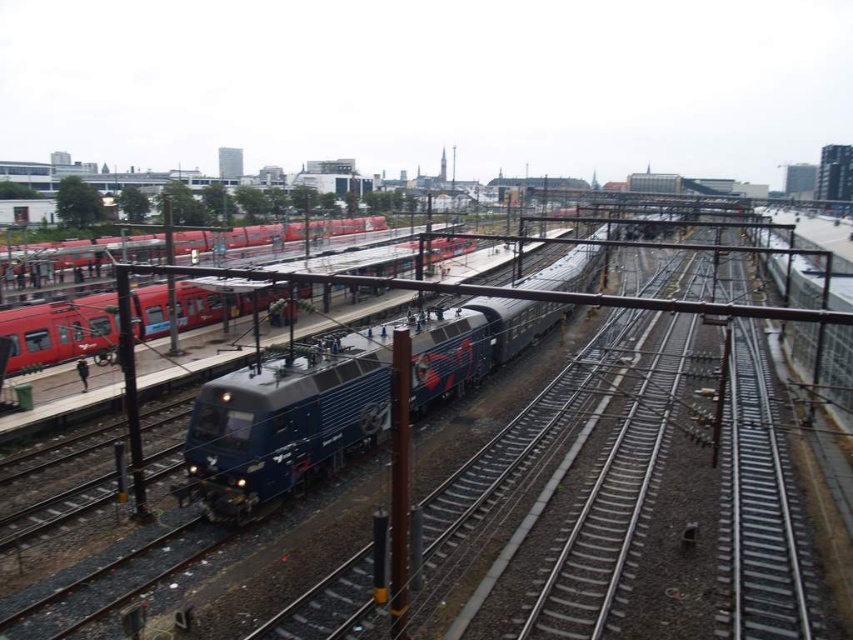
Question: Which point is farther to the camera?

Choices:
 (A) red matte train at left
 (B) metallic blue train at center
 (C) matte red train at left

Answer: (A)

Question: Does metallic blue train at center appear under red matte train at left?

Choices:
 (A) yes
 (B) no

Answer: (A)

Question: Which object appears closest to the camera in this image?

Choices:
 (A) red matte train at left
 (B) metallic blue train at center
 (C) matte red train at left
 (D) metallic blue locomotive at center

Answer: (B)

Question: Does metallic blue locomotive at center have a lesser width compared to matte red train at left?

Choices:
 (A) yes
 (B) no

Answer: (A)

Question: Which is farther from the metallic blue train at center?

Choices:
 (A) metallic blue locomotive at center
 (B) matte red train at left

Answer: (B)

Question: Can you confirm if metallic blue train at center is thinner than matte red train at left?

Choices:
 (A) yes
 (B) no

Answer: (B)